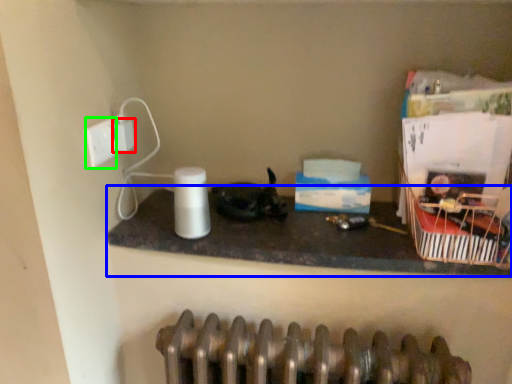
Question: Considering the real-world distances, which object is farthest from electric outlet (highlighted by a red box)? counter top (highlighted by a blue box) or socket (highlighted by a green box)?

Choices:
 (A) counter top
 (B) socket

Answer: (A)